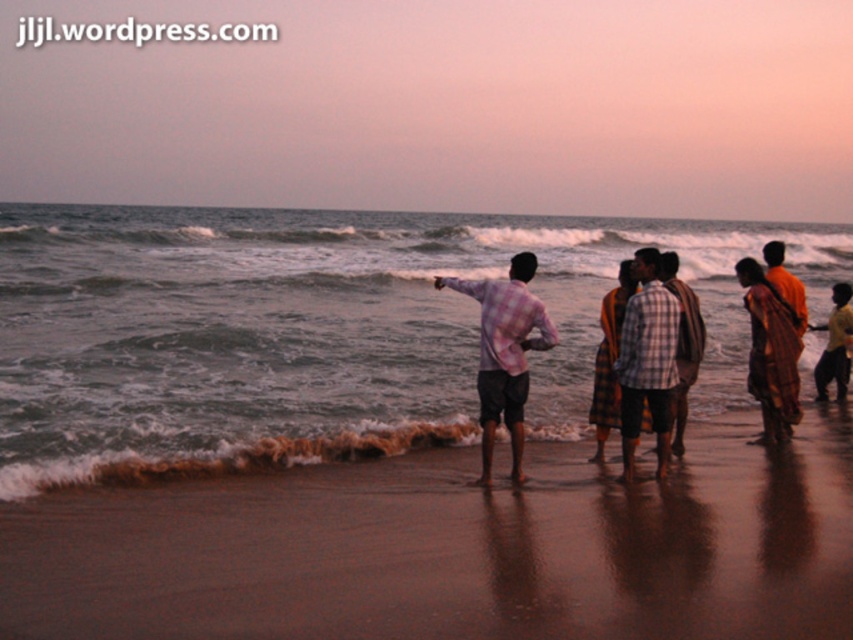
Between point (173, 310) and point (480, 342), which one is positioned behind?

Point (173, 310)

Who is more distant from viewer, (x=434, y=301) or (x=546, y=324)?

Point (x=434, y=301)

Where is `greenish-blue water at center`? greenish-blue water at center is located at coordinates (315, 330).

Based on the photo, can you confirm if checkered fabric shirt at center is taller than yellow cotton shirt at right?

Indeed, checkered fabric shirt at center has a greater height compared to yellow cotton shirt at right.

Does point (631, 460) lie behind point (827, 321)?

No, (631, 460) is closer to viewer.

The width and height of the screenshot is (853, 640). Describe the element at coordinates (647, 362) in the screenshot. I see `checkered fabric shirt at center` at that location.

Where is `checkered fabric shirt at center`? The image size is (853, 640). checkered fabric shirt at center is located at coordinates (x=647, y=362).

Can you confirm if greenish-blue water at center is taller than checkered fabric shirt at center?

Indeed, greenish-blue water at center has a greater height compared to checkered fabric shirt at center.

Consider the image. Can you confirm if greenish-blue water at center is wider than checkered fabric shirt at center?

Yes.

Where is `greenish-blue water at center`? The height and width of the screenshot is (640, 853). greenish-blue water at center is located at coordinates (315, 330).

You are a GUI agent. You are given a task and a screenshot of the screen. Output one action in this format:
    pyautogui.click(x=<x>, y=<y>)
    Task: Click on the greenish-blue water at center
    This screenshot has height=640, width=853.
    Given the screenshot: What is the action you would take?
    pyautogui.click(x=315, y=330)